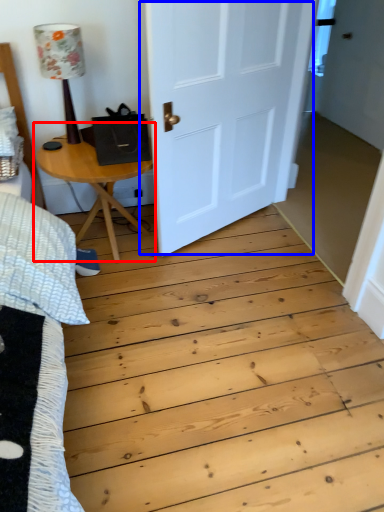
Question: Among these objects, which one is nearest to the camera, table (highlighted by a red box) or door (highlighted by a blue box)?

Choices:
 (A) table
 (B) door

Answer: (B)